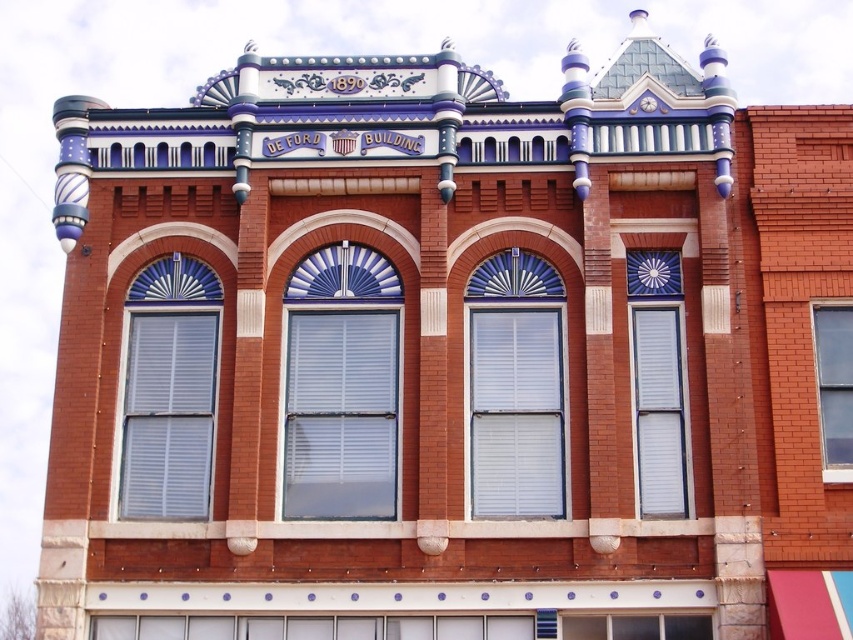
Can you confirm if blue glossy shutters at right is taller than clear glass window at right?

Indeed, blue glossy shutters at right has a greater height compared to clear glass window at right.

Between blue glossy shutters at right and clear glass window at right, which one has less height?

Standing shorter between the two is clear glass window at right.

You are a GUI agent. You are given a task and a screenshot of the screen. Output one action in this format:
    pyautogui.click(x=<x>, y=<y>)
    Task: Click on the blue glossy shutters at right
    The image size is (853, 640).
    Given the screenshot: What is the action you would take?
    pyautogui.click(x=657, y=381)

Who is lower down, white textured shutters at center or clear glass window at right?

clear glass window at right is below.

Which is more to the left, white textured shutters at center or clear glass window at right?

Positioned to the left is white textured shutters at center.

Locate an element on the screen. white textured shutters at center is located at coordinates (515, 387).

The image size is (853, 640). Identify the location of white textured shutters at center. (515, 387).

Locate an element on the screen. Image resolution: width=853 pixels, height=640 pixels. clear glass window at right is located at coordinates (834, 385).

Is clear glass window at right to the left of clear glass window at lower center from the viewer's perspective?

In fact, clear glass window at right is to the right of clear glass window at lower center.

Which is in front, point (827, 333) or point (698, 616)?

Point (698, 616)

At what (x,y) coordinates should I click in order to perform the action: click on clear glass window at right. Please return your answer as a coordinate pair (x, y). Image resolution: width=853 pixels, height=640 pixels. Looking at the image, I should click on (834, 385).